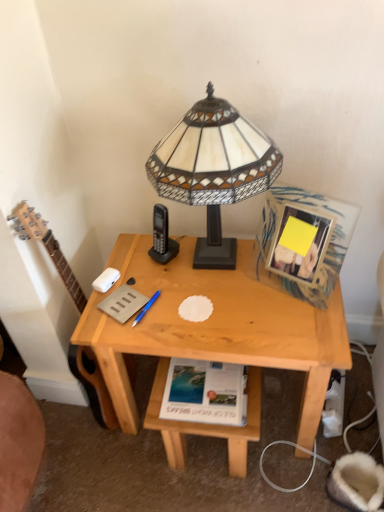
The width and height of the screenshot is (384, 512). In order to click on vacant space to the left of stained glass lampshade at center in this screenshot , I will do `click(134, 278)`.